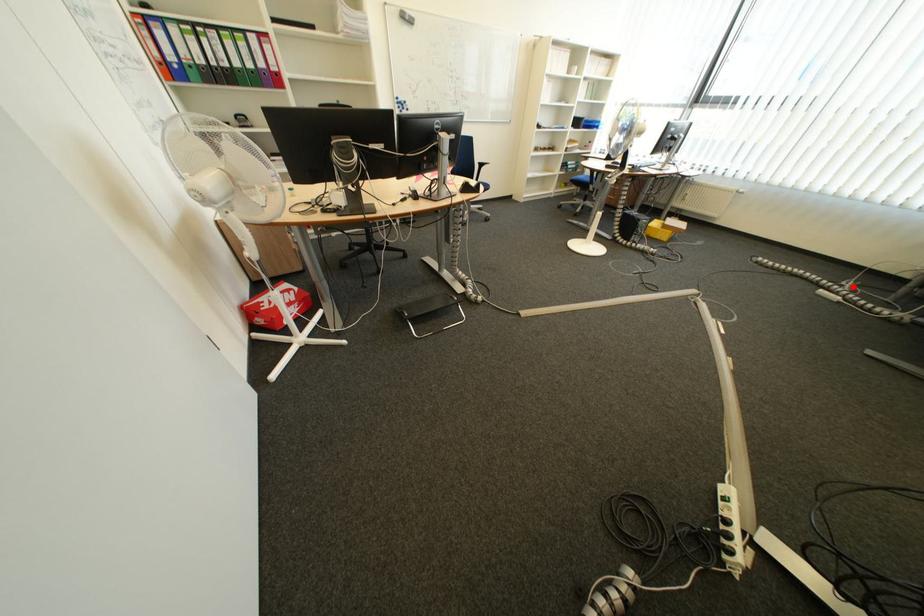
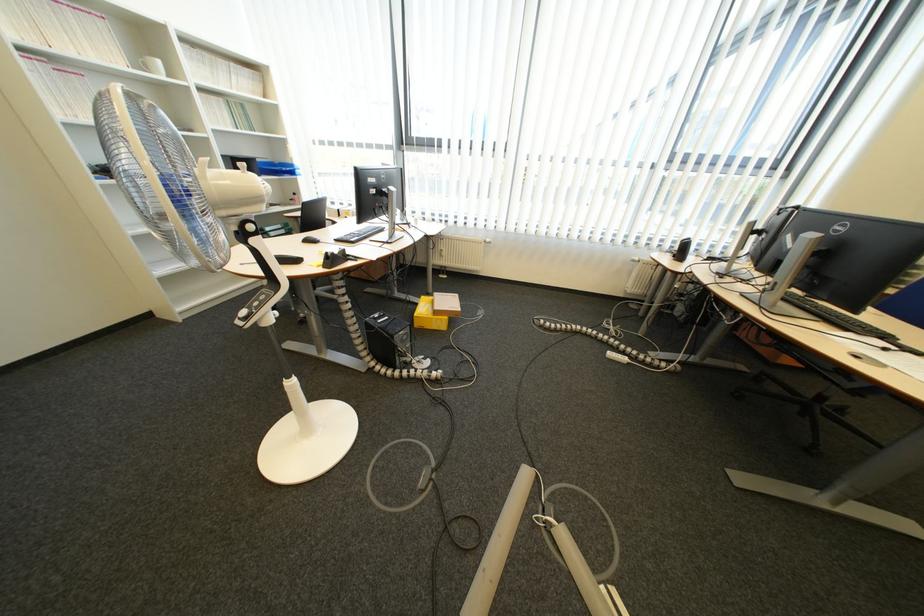
Question: I am providing you with two images of the same scene from different viewpoints. In image1, a red point is highlighted. Considering the same 3D point in image2, which of the following is correct?

Choices:
 (A) It is closer
 (B) It is farther

Answer: (A)